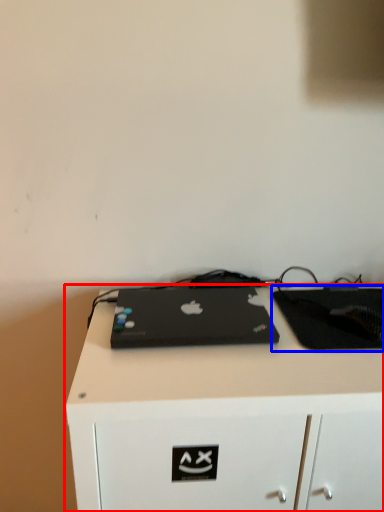
Question: Which object is closer to the camera taking this photo, desk (highlighted by a red box) or tablet computer (highlighted by a blue box)?

Choices:
 (A) desk
 (B) tablet computer

Answer: (A)